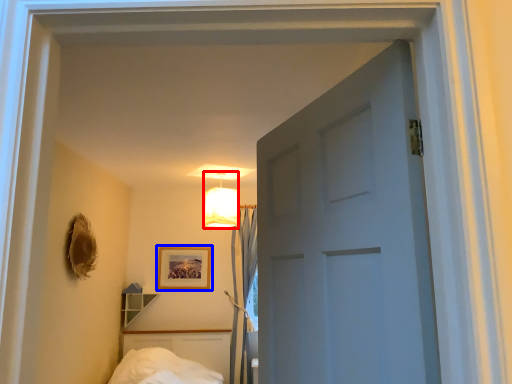
Question: Which object is further to the camera taking this photo, lamp (highlighted by a red box) or picture frame (highlighted by a blue box)?

Choices:
 (A) lamp
 (B) picture frame

Answer: (B)